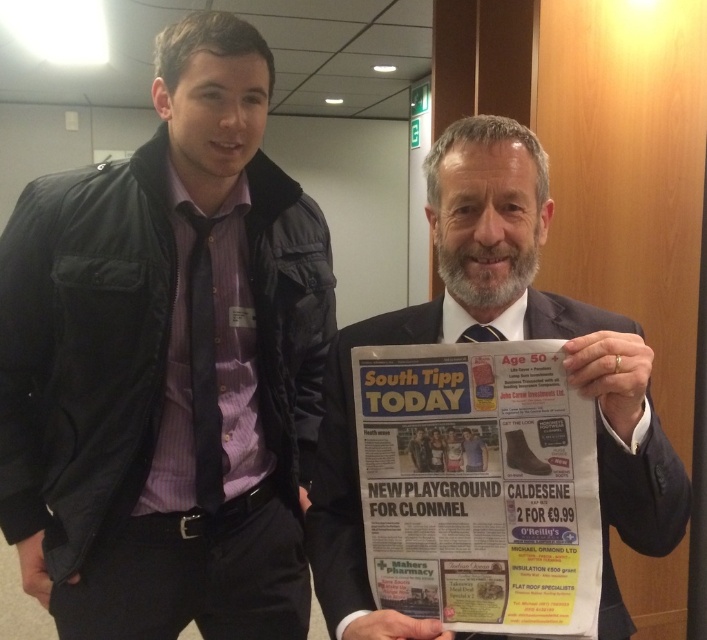
Does point (199, 403) lie behind point (489, 328)?

That is True.

You are a GUI agent. You are given a task and a screenshot of the screen. Output one action in this format:
    pyautogui.click(x=<x>, y=<y>)
    Task: Click on the dark blue textured tie at left
    The width and height of the screenshot is (707, 640).
    Given the screenshot: What is the action you would take?
    pyautogui.click(x=204, y=362)

Find the location of a particular element. This screenshot has height=640, width=707. dark blue textured tie at left is located at coordinates (204, 362).

Which of these two, matte black jacket at left or dark gray suit at center, stands taller?

matte black jacket at left

Who is positioned more to the right, matte black jacket at left or dark gray suit at center?

dark gray suit at center is more to the right.

Is point (158, 282) positioned in front of point (338, 452)?

No, it is not.

This screenshot has width=707, height=640. I want to click on matte black jacket at left, so click(x=168, y=365).

Is dark gray suit at center smaller than dark blue textured tie at left?

No.

Between dark gray suit at center and dark blue textured tie at left, which one appears on the right side from the viewer's perspective?

dark gray suit at center is more to the right.

Which is behind, point (626, 538) or point (201, 492)?

The point (201, 492) is more distant.

What are the coordinates of `dark gray suit at center` in the screenshot? It's located at (508, 339).